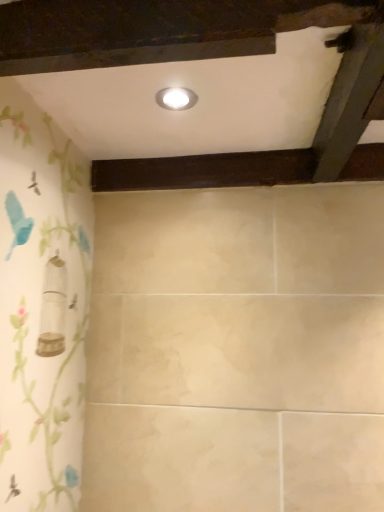
Question: From the image's perspective, is dark wood plank at center located above or below white glossy light fixture at upper center?

Choices:
 (A) above
 (B) below

Answer: (B)

Question: In terms of height, does dark wood plank at center look taller or shorter compared to white glossy light fixture at upper center?

Choices:
 (A) short
 (B) tall

Answer: (B)

Question: From a real-world perspective, relative to white glossy light fixture at upper center, is dark wood plank at center vertically above or below?

Choices:
 (A) above
 (B) below

Answer: (B)

Question: Is white glossy light fixture at upper center taller or shorter than dark wood plank at center?

Choices:
 (A) short
 (B) tall

Answer: (A)

Question: Is white glossy light fixture at upper center in front of or behind dark wood plank at center in the image?

Choices:
 (A) behind
 (B) front

Answer: (B)

Question: From the image's perspective, is white glossy light fixture at upper center positioned above or below dark wood plank at center?

Choices:
 (A) above
 (B) below

Answer: (A)

Question: Do you think white glossy light fixture at upper center is within dark wood plank at center, or outside of it?

Choices:
 (A) inside
 (B) outside

Answer: (B)